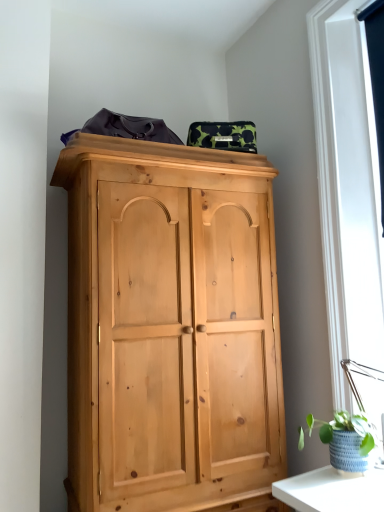
Question: Is green woven basket at lower right aimed at black fabric at upper right?

Choices:
 (A) yes
 (B) no

Answer: (B)

Question: Are green woven basket at lower right and black fabric at upper right far apart?

Choices:
 (A) no
 (B) yes

Answer: (B)

Question: Does green woven basket at lower right have a lesser width compared to black fabric at upper right?

Choices:
 (A) yes
 (B) no

Answer: (B)

Question: From a real-world perspective, is green woven basket at lower right over black fabric at upper right?

Choices:
 (A) yes
 (B) no

Answer: (B)

Question: From a real-world perspective, is green woven basket at lower right under black fabric at upper right?

Choices:
 (A) no
 (B) yes

Answer: (B)

Question: Is green woven basket at lower right at the right side of black fabric at upper right?

Choices:
 (A) yes
 (B) no

Answer: (B)

Question: Is black fabric at upper right positioned beyond the bounds of green woven basket at lower right?

Choices:
 (A) yes
 (B) no

Answer: (A)

Question: Can you confirm if black fabric at upper right is positioned to the right of green woven basket at lower right?

Choices:
 (A) yes
 (B) no

Answer: (A)

Question: From the image's perspective, is black fabric at upper right on top of green woven basket at lower right?

Choices:
 (A) no
 (B) yes

Answer: (B)

Question: From a real-world perspective, is black fabric at upper right on green woven basket at lower right?

Choices:
 (A) yes
 (B) no

Answer: (A)

Question: Could you tell me if black fabric at upper right is turned towards green woven basket at lower right?

Choices:
 (A) no
 (B) yes

Answer: (A)

Question: From a real-world perspective, is black fabric at upper right under green woven basket at lower right?

Choices:
 (A) yes
 (B) no

Answer: (B)

Question: Considering the relative positions of green woven basket at lower right and black fabric at upper right in the image provided, is green woven basket at lower right to the left or to the right of black fabric at upper right?

Choices:
 (A) left
 (B) right

Answer: (A)